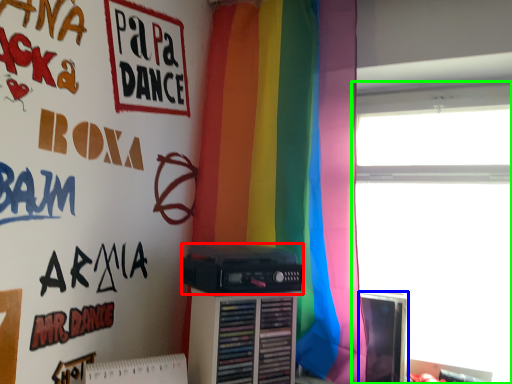
Question: Which is farther away from cassette (highlighted by a red box)? computer monitor (highlighted by a blue box) or window (highlighted by a green box)?

Choices:
 (A) computer monitor
 (B) window

Answer: (B)